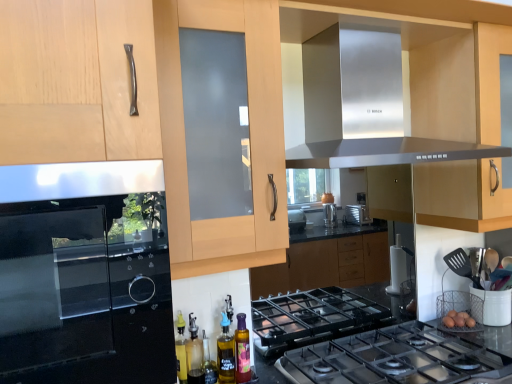
Question: Is matte wood cabinet at center taller or shorter than satin black oven at left?

Choices:
 (A) short
 (B) tall

Answer: (B)

Question: From a real-world perspective, is matte wood cabinet at center above or below satin black oven at left?

Choices:
 (A) below
 (B) above

Answer: (B)

Question: Considering the real-world distances, which object is farthest from the translucent glass bottle at lower center?

Choices:
 (A) matte wood cabinet at center
 (B) polished stainless steel gas stove at center
 (C) satin black oven at left
 (D) stainless steel exhaust hood at upper center

Answer: (A)

Question: Which object is positioned farthest from the translucent glass bottle at lower center?

Choices:
 (A) polished stainless steel gas stove at center
 (B) satin black oven at left
 (C) stainless steel exhaust hood at upper center
 (D) matte wood cabinet at center

Answer: (D)